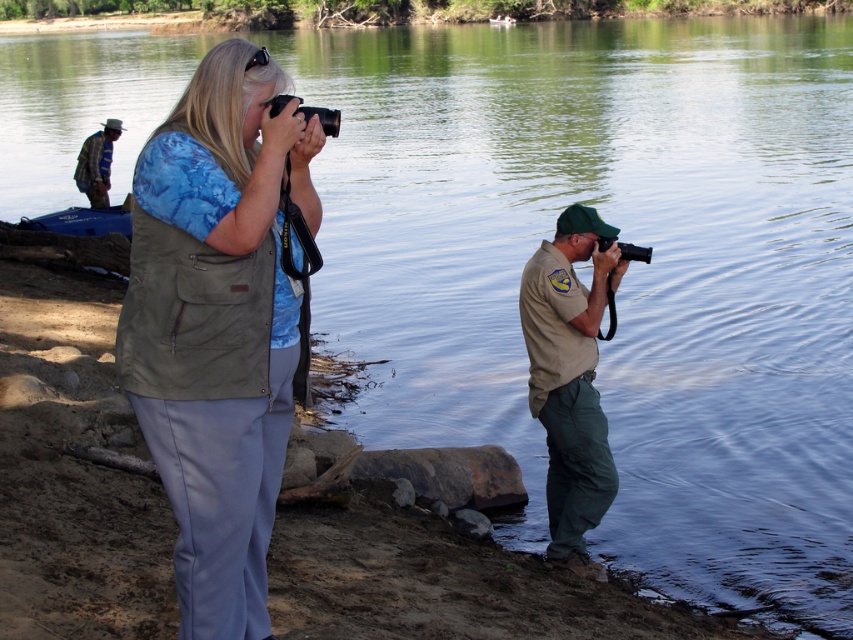
Question: Which object appears farthest from the camera in this image?

Choices:
 (A) matte khaki vest at center
 (B) khaki uniform at right
 (C) striped fabric shirt at upper left

Answer: (C)

Question: Can you confirm if matte khaki vest at center is positioned to the left of striped fabric shirt at upper left?

Choices:
 (A) no
 (B) yes

Answer: (A)

Question: Is matte khaki vest at center closer to the viewer compared to striped fabric shirt at upper left?

Choices:
 (A) no
 (B) yes

Answer: (B)

Question: Which point is farther to the camera?

Choices:
 (A) (90, 147)
 (B) (535, 291)

Answer: (A)

Question: Which object is closer to the camera taking this photo?

Choices:
 (A) matte khaki vest at center
 (B) khaki uniform at right
 (C) striped fabric shirt at upper left

Answer: (A)

Question: Can you confirm if matte khaki vest at center is positioned below striped fabric shirt at upper left?

Choices:
 (A) no
 (B) yes

Answer: (B)